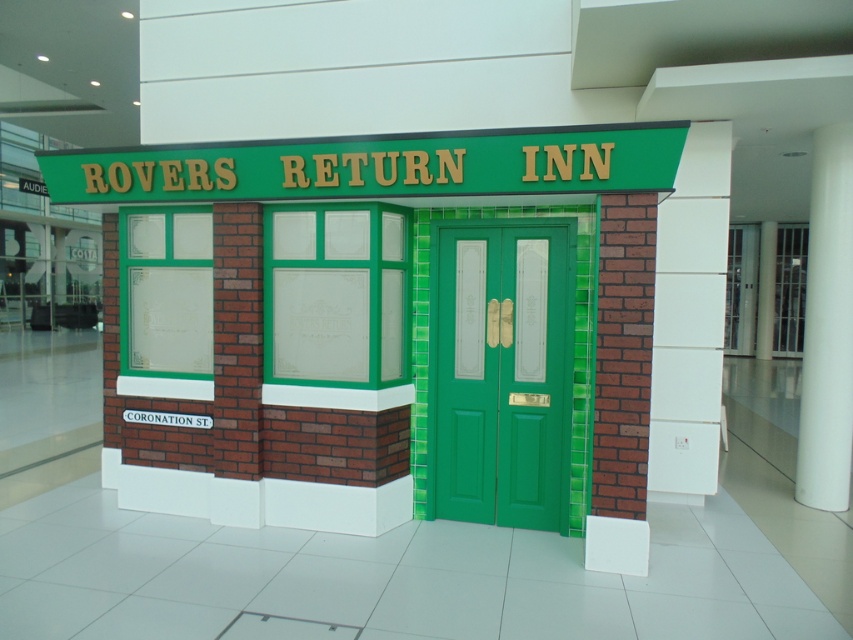
Question: Among these objects, which one is nearest to the camera?

Choices:
 (A) green painted wood door at center
 (B) green painted wood sign at upper center
 (C) white smooth pillar at right

Answer: (B)

Question: Does green painted wood door at center have a greater width compared to green painted wood sign at upper center?

Choices:
 (A) no
 (B) yes

Answer: (A)

Question: Considering the real-world distances, which object is closest to the green painted wood door at center?

Choices:
 (A) green painted wood sign at upper center
 (B) white smooth pillar at right

Answer: (A)

Question: Among these objects, which one is farthest from the camera?

Choices:
 (A) white smooth pillar at right
 (B) green painted wood sign at upper center
 (C) green painted wood door at center

Answer: (A)

Question: In this image, where is green painted wood door at center located relative to green painted wood sign at upper center?

Choices:
 (A) right
 (B) left

Answer: (A)

Question: Is green painted wood sign at upper center wider than white smooth pillar at right?

Choices:
 (A) no
 (B) yes

Answer: (B)